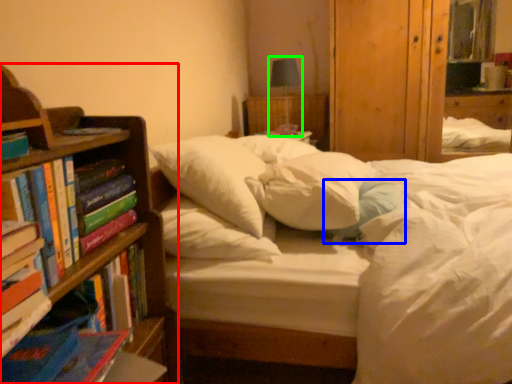
Question: Estimate the real-world distances between objects in this image. Which object is closer to bookcase (highlighted by a red box), pillow (highlighted by a blue box) or table lamp (highlighted by a green box)?

Choices:
 (A) pillow
 (B) table lamp

Answer: (A)